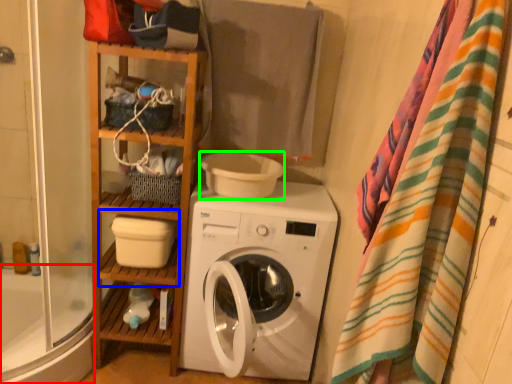
Question: Which object is positioned farthest from bath (highlighted by a red box)? Select from shelf (highlighted by a blue box) and toilet bowl (highlighted by a green box).

Choices:
 (A) shelf
 (B) toilet bowl

Answer: (B)